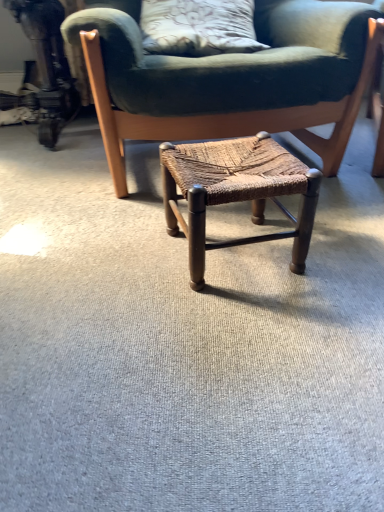
Measure the distance between point (301,136) and camera.

Point (301,136) is 4.83 feet away from camera.

The height and width of the screenshot is (512, 384). Describe the element at coordinates (230, 78) in the screenshot. I see `brown woven stool at center` at that location.

Identify the location of brown woven stool at center. The image size is (384, 512). (230, 78).

Describe the element at coordinates (236, 191) in the screenshot. This screenshot has height=512, width=384. I see `woven wood stool at center` at that location.

Where is `woven wood stool at center`? woven wood stool at center is located at coordinates (236, 191).

This screenshot has height=512, width=384. I want to click on brown woven stool at center, so click(230, 78).

Which is more to the right, brown woven stool at center or woven wood stool at center?

From the viewer's perspective, woven wood stool at center appears more on the right side.

Which is in front, brown woven stool at center or woven wood stool at center?

Positioned in front is woven wood stool at center.

Is point (149, 83) farther from camera compared to point (231, 158)?

That is True.

From the image's perspective, between brown woven stool at center and woven wood stool at center, who is located below?

woven wood stool at center.

From a real-world perspective, is brown woven stool at center above or below woven wood stool at center?

In terms of real-world spatial position, brown woven stool at center is above woven wood stool at center.

Does brown woven stool at center have a greater width compared to woven wood stool at center?

Yes, brown woven stool at center is wider than woven wood stool at center.

Based on the photo, is brown woven stool at center shorter than woven wood stool at center?

No, brown woven stool at center is not shorter than woven wood stool at center.

Can you confirm if brown woven stool at center is smaller than woven wood stool at center?

No, brown woven stool at center is not smaller than woven wood stool at center.

Would you say brown woven stool at center is outside woven wood stool at center?

Yes.

Consider the image. Is brown woven stool at center with woven wood stool at center?

No, brown woven stool at center is not beside woven wood stool at center.

Is brown woven stool at center facing towards woven wood stool at center?

Yes, brown woven stool at center is aimed at woven wood stool at center.

What's the angular difference between brown woven stool at center and woven wood stool at center's facing directions?

There is a 3.77-degree angle between the facing directions of brown woven stool at center and woven wood stool at center.

Where is `stool in front of the brown woven stool at center`? The image size is (384, 512). stool in front of the brown woven stool at center is located at coordinates (236, 191).

In the scene shown: Considering the positions of objects woven wood stool at center and brown woven stool at center in the image provided, who is more to the left, woven wood stool at center or brown woven stool at center?

brown woven stool at center is more to the left.

In the scene shown: Is woven wood stool at center closer to camera compared to brown woven stool at center?

Yes, woven wood stool at center is closer to the camera.

Which is behind, point (233, 172) or point (101, 55)?

The point (101, 55) is farther.

From the image's perspective, which is below, woven wood stool at center or brown woven stool at center?

woven wood stool at center is shown below in the image.

From a real-world perspective, who is located lower, woven wood stool at center or brown woven stool at center?

In real-world perspective, woven wood stool at center is lower.

Consider the image. Looking at their sizes, would you say woven wood stool at center is wider or thinner than brown woven stool at center?

woven wood stool at center is thinner than brown woven stool at center.

Based on the photo, from their relative heights in the image, would you say woven wood stool at center is taller or shorter than brown woven stool at center?

Considering their sizes, woven wood stool at center has less height than brown woven stool at center.

Can you confirm if woven wood stool at center is bigger than brown woven stool at center?

No.

Is woven wood stool at center inside the boundaries of brown woven stool at center, or outside?

woven wood stool at center is not enclosed by brown woven stool at center.

Is woven wood stool at center placed right next to brown woven stool at center?

No, woven wood stool at center is not with brown woven stool at center.

Does woven wood stool at center turn towards brown woven stool at center?

No, woven wood stool at center is not oriented towards brown woven stool at center.

Locate an element on the screen. The width and height of the screenshot is (384, 512). stool lying on the right of brown woven stool at center is located at coordinates (236, 191).

Where is `chair above the woven wood stool at center (from the image's perspective)`? chair above the woven wood stool at center (from the image's perspective) is located at coordinates (230, 78).

Identify the location of chair that appears above the woven wood stool at center (from a real-world perspective). (230, 78).